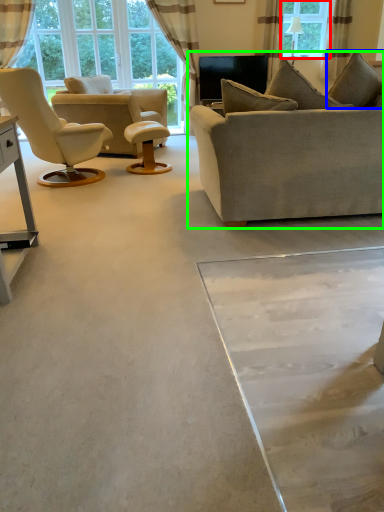
Question: Which object is positioned farthest from window (highlighted by a red box)? Select from pillow (highlighted by a blue box) and studio couch (highlighted by a green box).

Choices:
 (A) pillow
 (B) studio couch

Answer: (B)